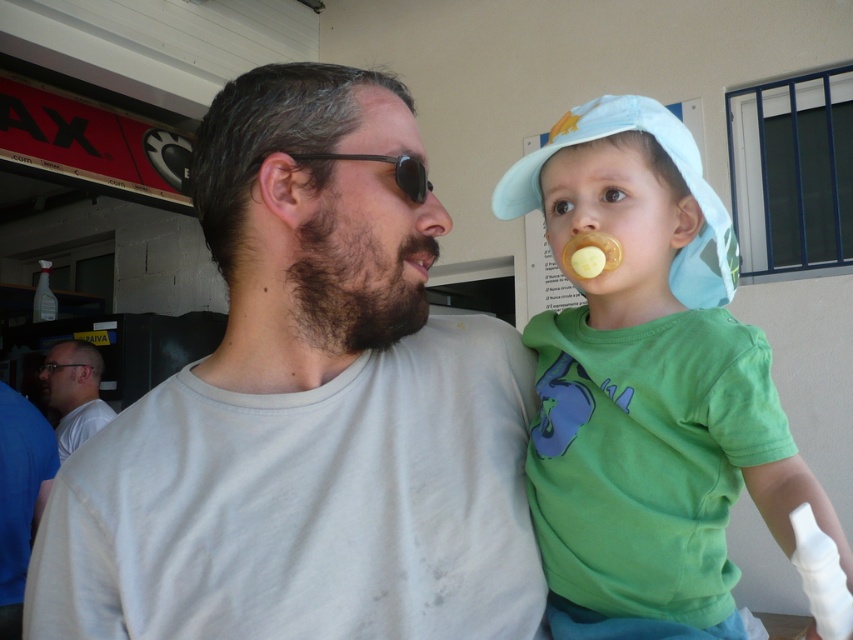
Can you confirm if light blue fabric baseball cap at upper right is wider than matte yellow pacifier at upper center?

Yes.

Does light blue fabric baseball cap at upper right have a lesser height compared to matte yellow pacifier at upper center?

In fact, light blue fabric baseball cap at upper right may be taller than matte yellow pacifier at upper center.

Describe the element at coordinates (666, 157) in the screenshot. This screenshot has height=640, width=853. I see `light blue fabric baseball cap at upper right` at that location.

The height and width of the screenshot is (640, 853). I want to click on light blue fabric baseball cap at upper right, so click(x=666, y=157).

Between matte brown nose at upper center and matte yellow pacifier at upper center, which one is positioned higher?

Positioned higher is matte brown nose at upper center.

Which is behind, point (410, 195) or point (578, 204)?

Point (578, 204)

Does point (410, 198) lie in front of point (582, 212)?

That is True.

Find the location of a particular element. The height and width of the screenshot is (640, 853). matte brown nose at upper center is located at coordinates (430, 214).

This screenshot has width=853, height=640. What do you see at coordinates (647, 385) in the screenshot?
I see `light blue fabric hat at upper right` at bounding box center [647, 385].

How much distance is there between light blue fabric hat at upper right and beardroughman's face at center?

light blue fabric hat at upper right and beardroughman's face at center are 25.40 centimeters apart from each other.

Who is more forward, (x=647, y=208) or (x=432, y=237)?

Positioned in front is point (x=432, y=237).

I want to click on light blue fabric hat at upper right, so click(647, 385).